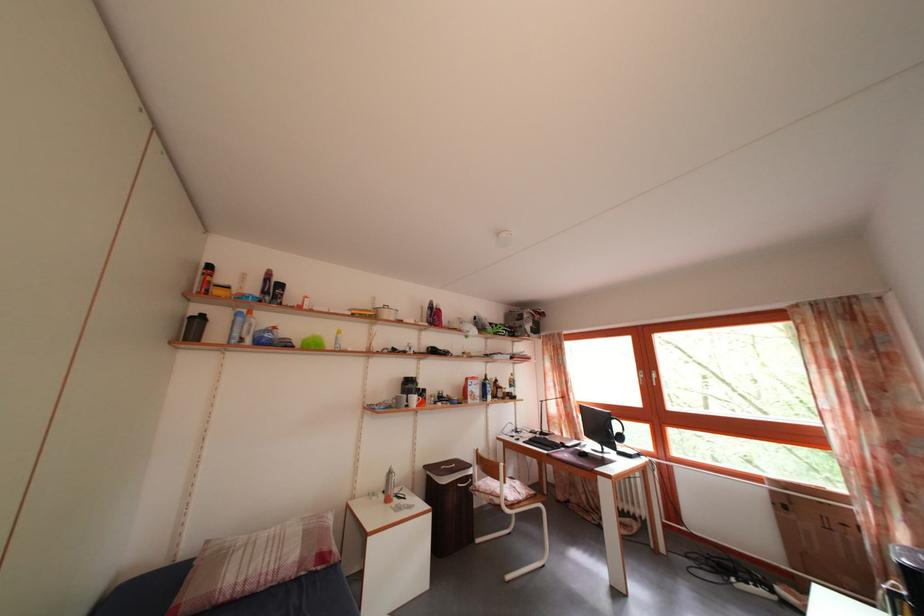
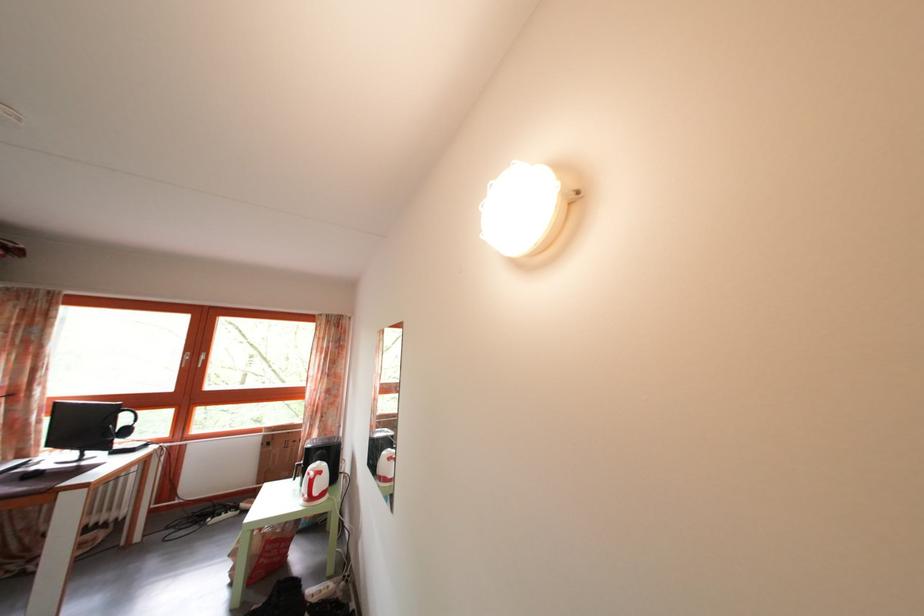
The point at (652, 382) is marked in the first image. Where is the corresponding point in the second image?

(199, 363)